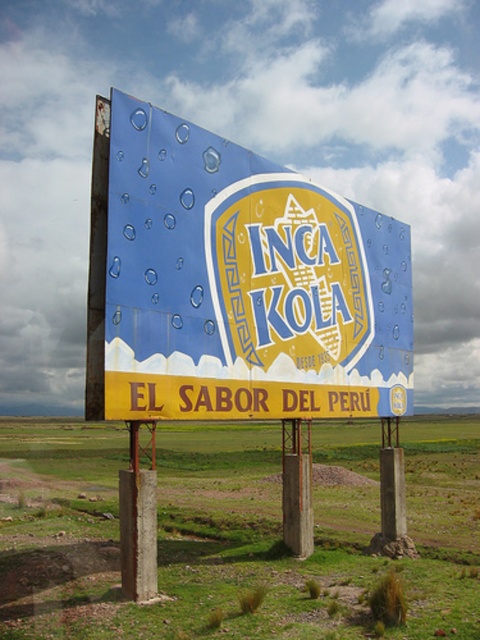
Question: Which point is farther to the camera?

Choices:
 (A) (233, 148)
 (B) (359, 317)

Answer: (B)

Question: Which point is farther to the camera?

Choices:
 (A) green grass at center
 (B) blue painted billboard at center

Answer: (B)

Question: Among these points, which one is farthest from the camera?

Choices:
 (A) (437, 502)
 (B) (296, 321)
 (C) (311, 413)

Answer: (A)

Question: Can you confirm if green grass at center is smaller than blue painted billboard at center?

Choices:
 (A) yes
 (B) no

Answer: (B)

Question: Is green grass at center closer to camera compared to yellow matte sign at center?

Choices:
 (A) yes
 (B) no

Answer: (A)

Question: Is blue painted billboard at center to the left of yellow matte sign at center from the viewer's perspective?

Choices:
 (A) no
 (B) yes

Answer: (B)